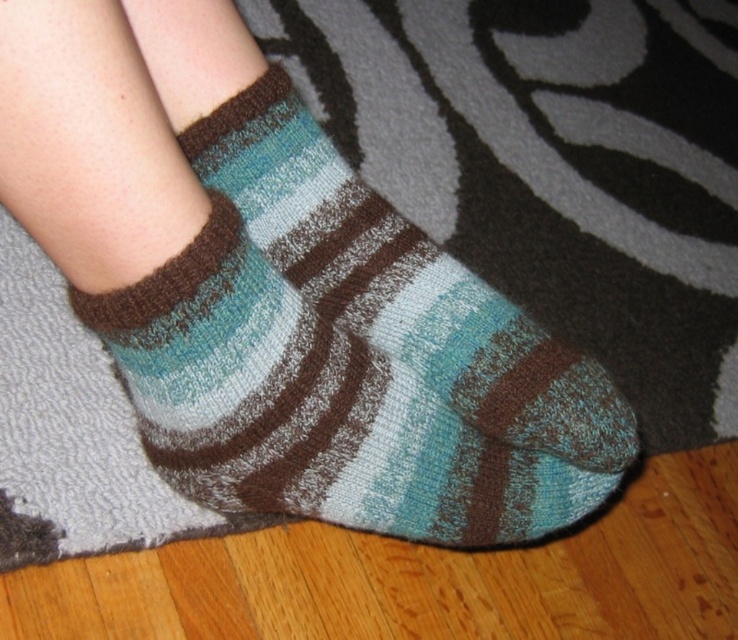
You are trying to match a pair of socks for a gift. You have a teal striped sock at lower center and a teal knitted sock at center. Which sock should you choose to ensure they are the same size?

The teal striped sock at lower center is larger in size than the teal knitted sock at center, so you should choose the teal knitted sock at center to ensure they are the same size.

You are standing in a room with a zebra rug and want to place a teal striped sock at lower center and a teal knitted sock at center on the rug. Based on their positions, which sock is closer to the left edge of the rug?

The teal striped sock at lower center is closer to the left edge of the rug because it is positioned to the left of the teal knitted sock at center.

You are a tailor measuring the distance between two teal socks on a zebra rug. The socks are labeled as teal striped sock at lower center and teal knitted sock at center. Can you fit a 2.5 cm wide ruler between them?

The distance between the teal striped sock at lower center and the teal knitted sock at center is 3.05 centimeters, so yes, a 2.5 cm wide ruler can fit between them since the space is wider than the ruler.